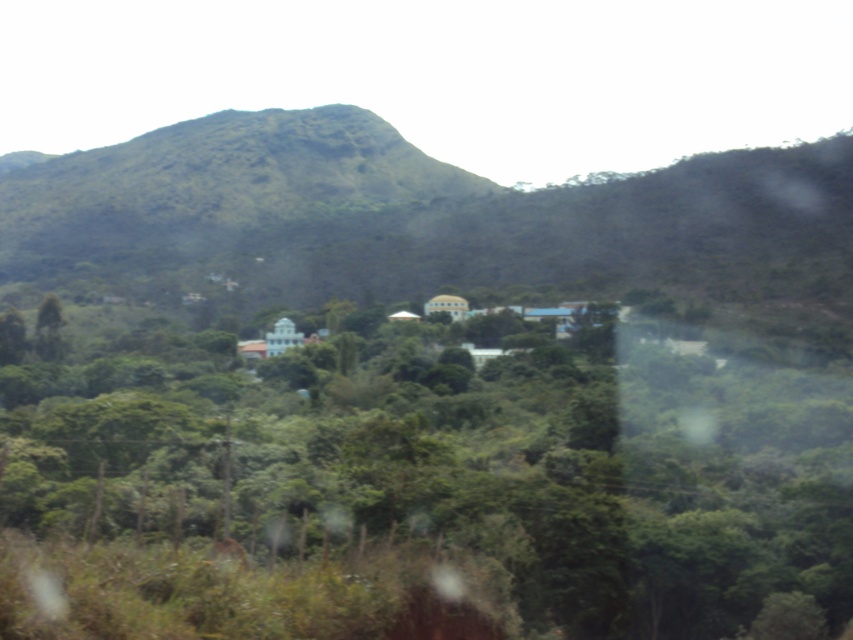
You are a hiker standing at the edge of the dense vegetation in the foreground. You want to reach the cluster of buildings in the midground. Which object, the green leafy tree at center or the green grassy mountain at center, would you have to navigate around first?

The green leafy tree at center is thinner than the green grassy mountain at center, so you would have to navigate around the green leafy tree at center first since it is closer to your current position in the foreground.

You are standing at the edge of the dense vegetation in the foreground and want to walk towards the cluster of buildings in the midground. Which object, the green leafy tree at center or the green grassy mountain at center, would you encounter first?

You would encounter the green leafy tree at center first because it is shorter than the green grassy mountain at center, making it closer to your current position.

You are standing at the center of the rural landscape and notice a point marked at coordinates (x=416, y=483). What object is located at this point?

The point at coordinates (x=416, y=483) corresponds to the green leafy tree at center.